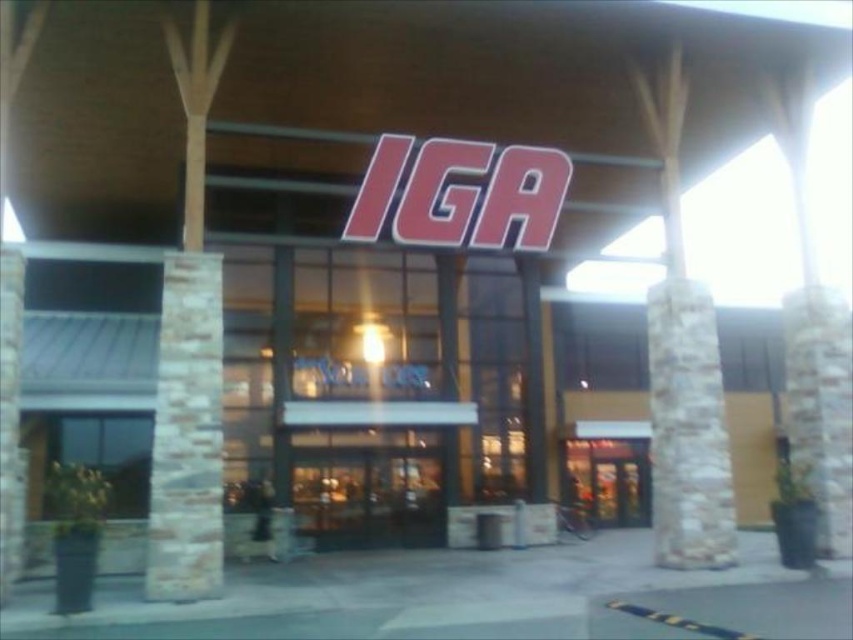
Which of these two, stone/textured pillar at left or glass door at center, stands shorter?

With less height is glass door at center.

Is stone/textured pillar at left bigger than glass door at center?

No.

Locate an element on the screen. This screenshot has width=853, height=640. stone/textured pillar at left is located at coordinates (187, 435).

Does point (187, 572) lie behind point (693, 392)?

No, (187, 572) is closer to viewer.

Between point (194, 481) and point (654, 412), which one is positioned behind?

Point (654, 412)

In order to click on stone/textured pillar at left in this screenshot , I will do `click(187, 435)`.

Which is below, white stone pillar at center or metallic glass door at center?

metallic glass door at center is below.

Where is `white stone pillar at center`? white stone pillar at center is located at coordinates 688,429.